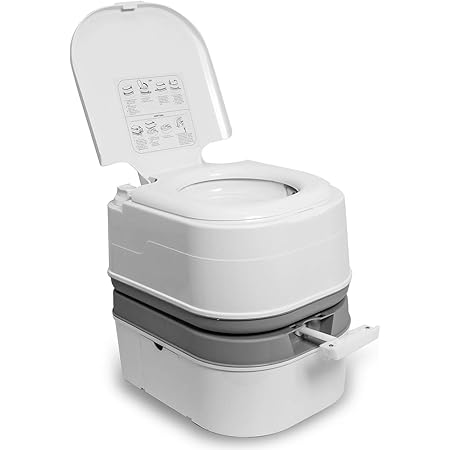
Locate an element on the screen. The width and height of the screenshot is (450, 450). seat is located at coordinates (207, 210), (294, 175).